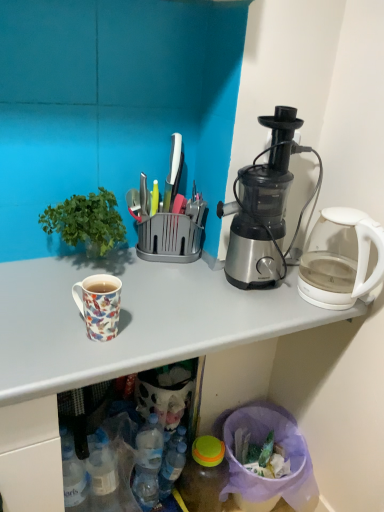
This screenshot has height=512, width=384. I want to click on free location to the right of green leafy plant at left, so click(161, 287).